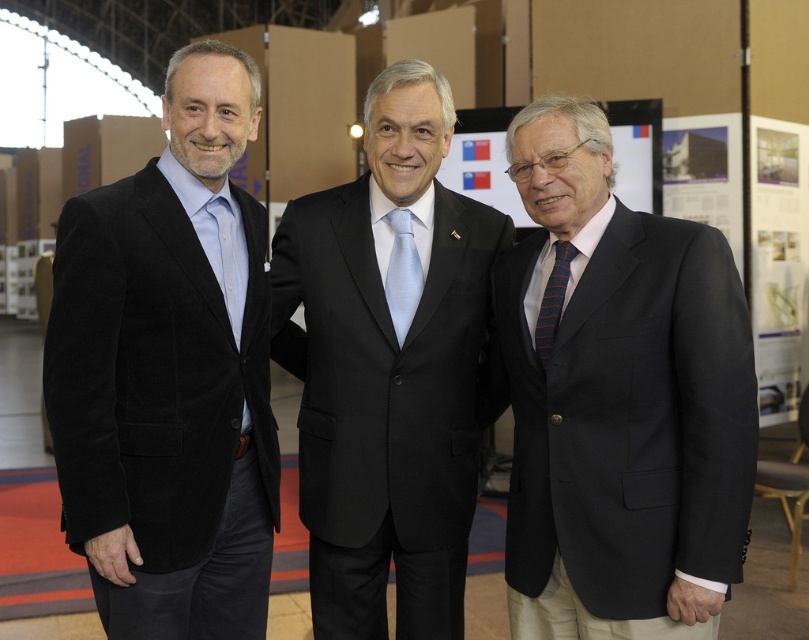
Is velvet black suit at left bigger than black satin suit at center?

A: Incorrect, velvet black suit at left is not larger than black satin suit at center.

Which is in front, point (79, 298) or point (383, 492)?

Point (79, 298) is in front.

The height and width of the screenshot is (640, 809). Identify the location of velvet black suit at left. (168, 372).

Is velvet black suit at left thinner than striped fabric tie at center?

Incorrect, velvet black suit at left's width is not less than striped fabric tie at center's.

Which is behind, point (125, 499) or point (564, 289)?

The point (564, 289) is more distant.

Which is behind, point (87, 336) or point (565, 253)?

Positioned behind is point (565, 253).

Where is `velvet black suit at left`? The height and width of the screenshot is (640, 809). velvet black suit at left is located at coordinates (168, 372).

Is velvet black suit at left further to camera compared to light blue silk tie at center?

No.

Does velvet black suit at left appear under light blue silk tie at center?

Indeed, velvet black suit at left is positioned under light blue silk tie at center.

Does point (104, 518) lie in front of point (401, 301)?

Yes, it is in front of point (401, 301).

The image size is (809, 640). I want to click on velvet black suit at left, so click(x=168, y=372).